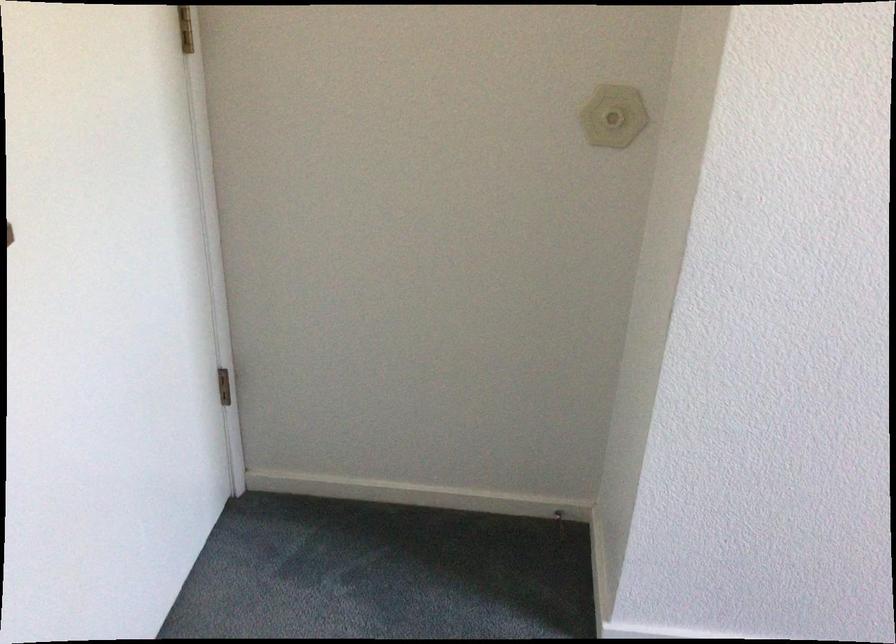
The image size is (896, 644). I want to click on doorbell chime cover, so click(x=613, y=116).